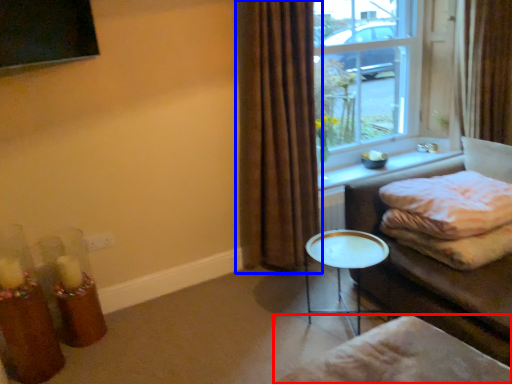
Question: Which point is further to the camera, footrest (highlighted by a red box) or curtain (highlighted by a blue box)?

Choices:
 (A) footrest
 (B) curtain

Answer: (B)